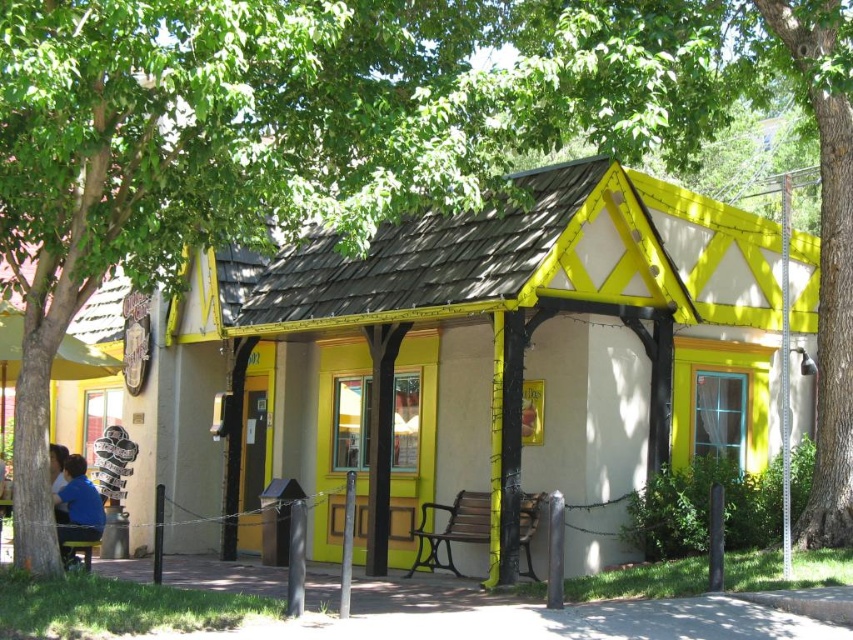
You are standing in front of the yellow wood cabin at center and want to walk to the blue shirt at lower left. Which direction should you move relative to the cabin?

The yellow wood cabin at center is positioned over the blue shirt at lower left, so to reach the blue shirt at lower left, you should move downward from the cabin.

You are standing in front of the yellow wood cabin at center and the blue shirt at lower left. Which object is located to the right side of the other?

The yellow wood cabin at center is positioned on the right side of blue shirt at lower left, so the yellow wood cabin at center is to the right of the blue shirt at lower left.